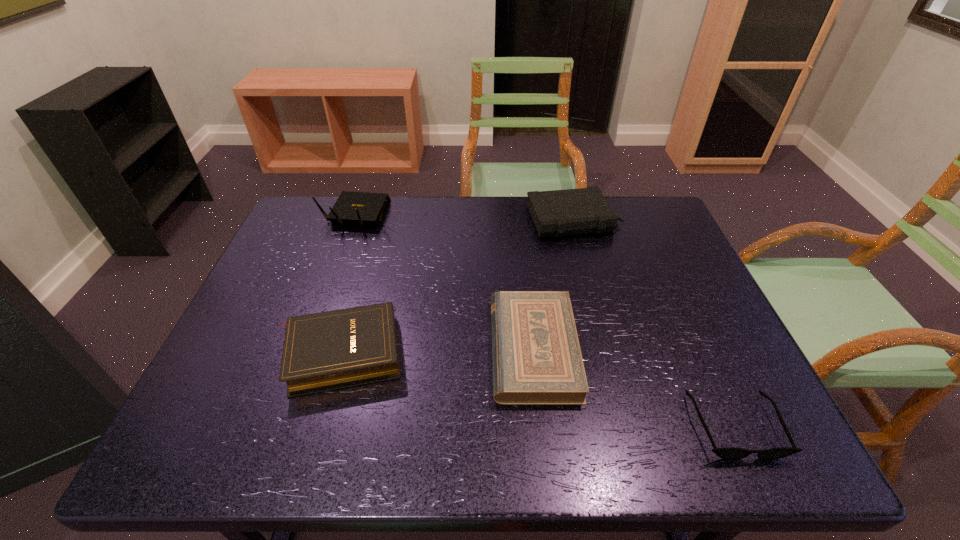
The width and height of the screenshot is (960, 540). What are the coordinates of `free space located on the spine side of the shortest Bible` in the screenshot? It's located at (406, 349).

Image resolution: width=960 pixels, height=540 pixels. Identify the location of router that is at the far edge. (358, 208).

This screenshot has height=540, width=960. I want to click on Bible that is at the far edge, so click(556, 213).

You are a GUI agent. You are given a task and a screenshot of the screen. Output one action in this format:
    pyautogui.click(x=<x>, y=<y>)
    Task: Click on the object present at the near edge
    
    Given the screenshot: What is the action you would take?
    pyautogui.click(x=729, y=453)

Where is `router at the left edge`? The image size is (960, 540). router at the left edge is located at coordinates (358, 208).

This screenshot has height=540, width=960. I want to click on Bible that is positioned at the left edge, so click(329, 350).

Locate an element on the screen. Bible located in the right edge section of the desktop is located at coordinates (556, 213).

Where is `sunglasses that is at the right edge`? This screenshot has width=960, height=540. sunglasses that is at the right edge is located at coordinates (729, 453).

Where is `object situated at the far left corner`? The height and width of the screenshot is (540, 960). object situated at the far left corner is located at coordinates (358, 208).

Identify the location of object located at the far right corner. (556, 213).